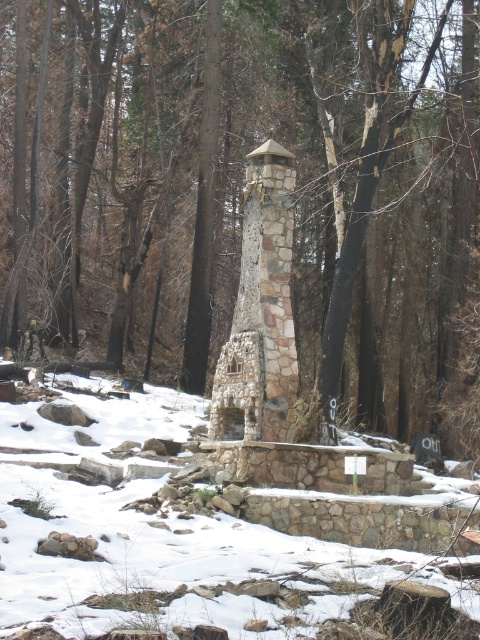
Does point (176, 612) lie in front of point (288, 438)?

Yes, point (176, 612) is closer to viewer.

Does white powdery snow at center appear under stone textured chimney at center?

Correct, white powdery snow at center is located below stone textured chimney at center.

Describe the element at coordinates (204, 528) in the screenshot. This screenshot has width=480, height=640. I see `white powdery snow at center` at that location.

I want to click on white powdery snow at center, so click(x=204, y=528).

Who is shorter, smooth bark tree at center or stone textured chimney at center?

With less height is stone textured chimney at center.

In the scene shown: Who is more forward, (20, 349) or (235, 355)?

Point (235, 355)

The height and width of the screenshot is (640, 480). In order to click on smooth bark tree at center in this screenshot , I will do `click(245, 186)`.

This screenshot has height=640, width=480. Find the location of `smooth bark tree at center`. smooth bark tree at center is located at coordinates (245, 186).

From the picture: Does smooth bark tree at center have a greater width compared to white powdery snow at center?

Yes.

Does point (171, 115) come closer to viewer compared to point (172, 618)?

No, it is behind (172, 618).

Locate an element on the screen. smooth bark tree at center is located at coordinates (245, 186).